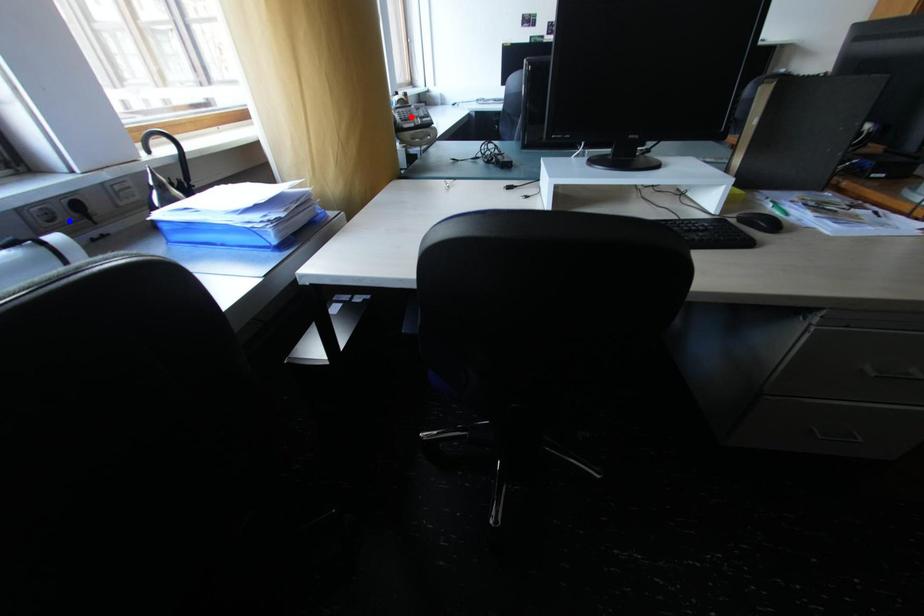
Question: Which of the two points in the image is closer to the camera?

Choices:
 (A) Blue point is closer.
 (B) Red point is closer.

Answer: (A)